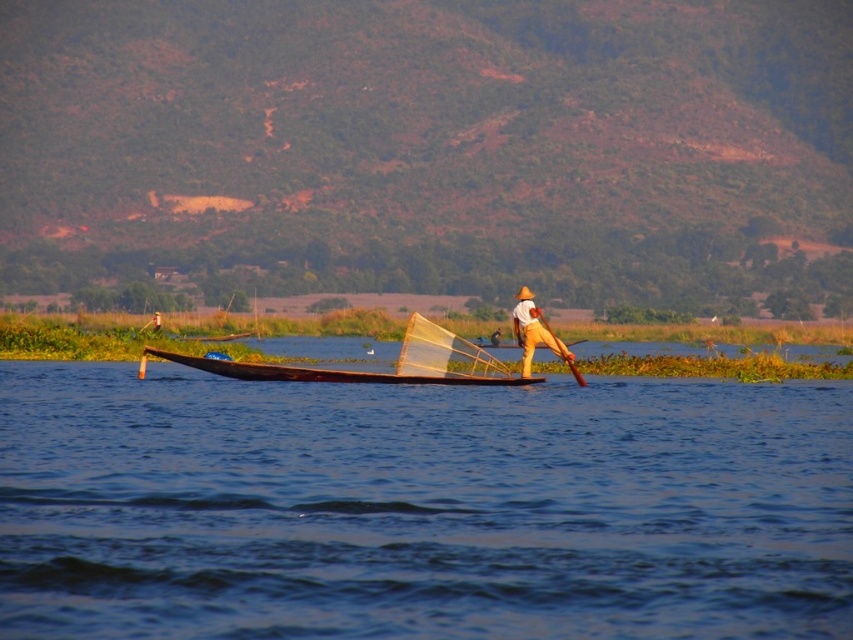
You are planning to transport a large cargo across the lake. Given the blue wooden boat at center and the wooden canoe at center, which one would you choose and why?

The blue wooden boat at center is wider than the wooden canoe at center, so it can carry more cargo and is more stable, making it the better choice for transporting large cargo.